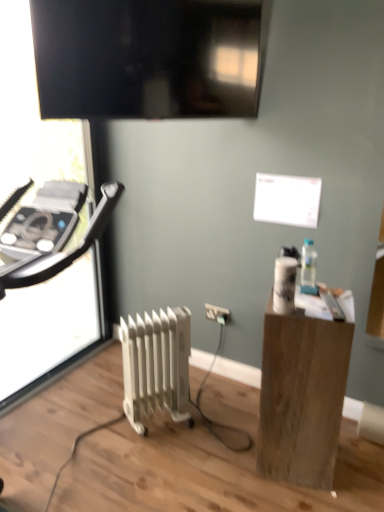
I want to click on free region on the left part of white metallic radiator at center, so click(x=100, y=434).